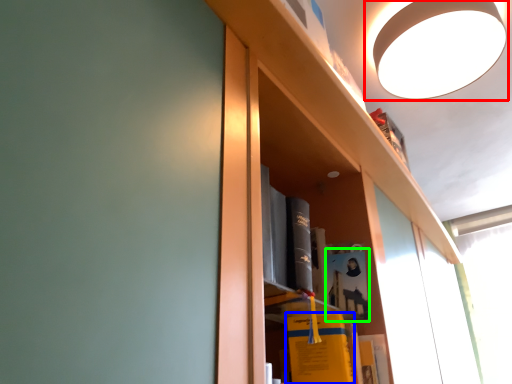
Question: Which object is positioned farthest from lamp (highlighted by a red box)? Select from book (highlighted by a blue box) and book (highlighted by a green box).

Choices:
 (A) book
 (B) book

Answer: (A)